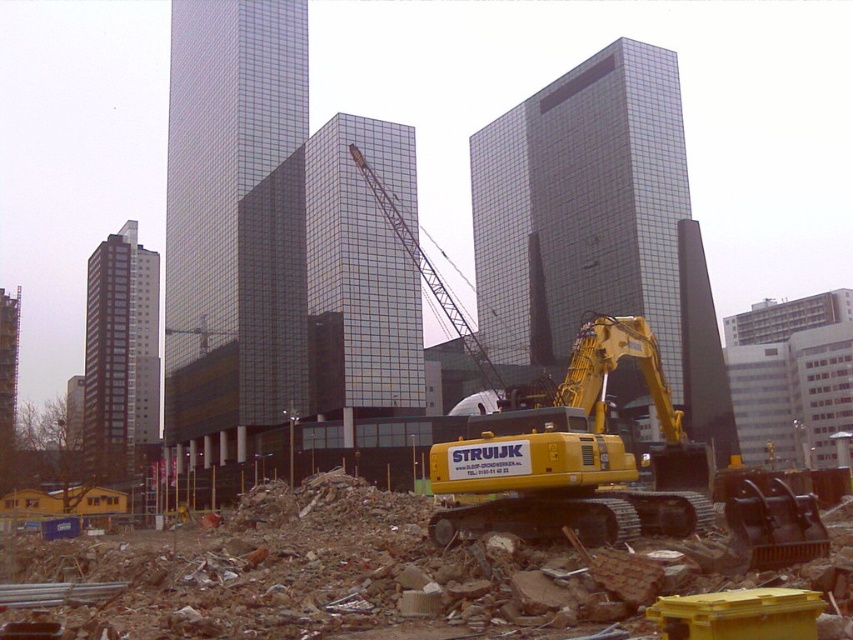
You are a construction supervisor planning to move the yellow rubber tracked excavator at center and the metallic yellow crane at center to a new site. Which machine will require a larger trailer to transport?

The metallic yellow crane at center requires a larger trailer because it is bigger than the yellow rubber tracked excavator at center.

You are a delivery driver who needs to bring a heavy equipment part to the construction site. The part requires a clear path of at least 60 meters to be safely transported. Based on the scene, can you determine if the yellow rubber tracked excavator at center and the metallic yellow crane at center have enough space between them for the delivery?

The distance between the yellow rubber tracked excavator at center and the metallic yellow crane at center is 58.97 meters. Since the required clear path is 60 meters, the space between them is insufficient for the delivery.